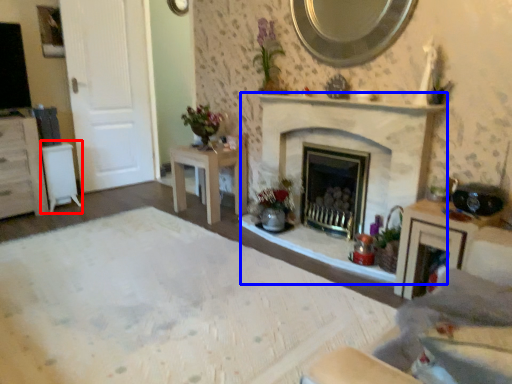
Question: Which of the following is the farthest to the observer, table (highlighted by a red box) or fireplace (highlighted by a blue box)?

Choices:
 (A) table
 (B) fireplace

Answer: (A)